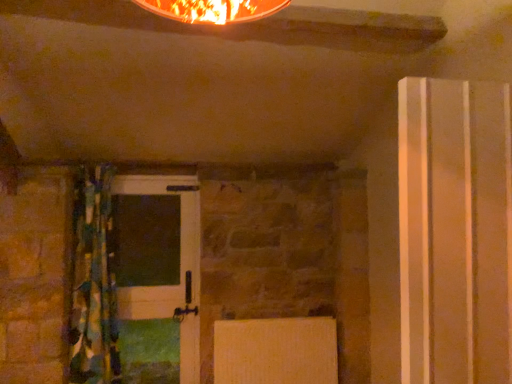
Question: Is transparent plastic door at right, which is counted as the first door, starting from the right, bigger or smaller than white glossy door at center, the 1th door in the left-to-right sequence?

Choices:
 (A) small
 (B) big

Answer: (B)

Question: In the image, is transparent plastic door at right, the 1th door when ordered from front to back, on the left side or the right side of white glossy door at center, acting as the 2th door starting from the front?

Choices:
 (A) left
 (B) right

Answer: (B)

Question: Estimate the real-world distances between objects in this image. Which object is closer to the white glossy door at center, the 1th door in the left-to-right sequence?

Choices:
 (A) textured multicolored curtain at left
 (B) transparent plastic door at right, which is counted as the first door, starting from the right

Answer: (A)

Question: Estimate the real-world distances between objects in this image. Which object is farther from the white glossy door at center, the 1th door from the back?

Choices:
 (A) transparent plastic door at right, which is the second door in left-to-right order
 (B) textured multicolored curtain at left

Answer: (A)